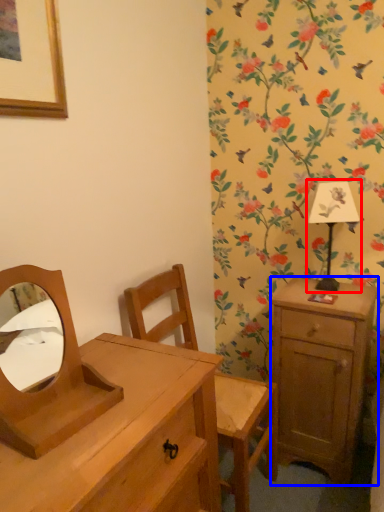
Question: Which object is closer to the camera taking this photo, bedside lamp (highlighted by a red box) or nightstand (highlighted by a blue box)?

Choices:
 (A) bedside lamp
 (B) nightstand

Answer: (B)